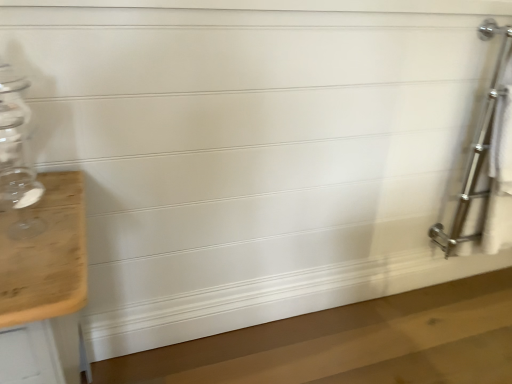
Question: Considering the relative sizes of transparent glass jar at left and polished chrome towel rack at right in the image provided, is transparent glass jar at left thinner than polished chrome towel rack at right?

Choices:
 (A) no
 (B) yes

Answer: (A)

Question: Considering the relative sizes of transparent glass jar at left and polished chrome towel rack at right in the image provided, is transparent glass jar at left shorter than polished chrome towel rack at right?

Choices:
 (A) yes
 (B) no

Answer: (A)

Question: Is transparent glass jar at left taller than polished chrome towel rack at right?

Choices:
 (A) no
 (B) yes

Answer: (A)

Question: Considering the relative positions of transparent glass jar at left and polished chrome towel rack at right in the image provided, is transparent glass jar at left to the right of polished chrome towel rack at right from the viewer's perspective?

Choices:
 (A) no
 (B) yes

Answer: (A)

Question: Is the surface of transparent glass jar at left in direct contact with polished chrome towel rack at right?

Choices:
 (A) no
 (B) yes

Answer: (A)

Question: Does transparent glass jar at left have a smaller size compared to polished chrome towel rack at right?

Choices:
 (A) no
 (B) yes

Answer: (B)

Question: Is polished chrome towel rack at right positioned with its back to transparent glass jar at left?

Choices:
 (A) yes
 (B) no

Answer: (B)

Question: Can you confirm if polished chrome towel rack at right is positioned to the left of transparent glass jar at left?

Choices:
 (A) no
 (B) yes

Answer: (A)

Question: Is polished chrome towel rack at right far away from transparent glass jar at left?

Choices:
 (A) no
 (B) yes

Answer: (B)

Question: From a real-world perspective, is polished chrome towel rack at right positioned over transparent glass jar at left based on gravity?

Choices:
 (A) yes
 (B) no

Answer: (B)

Question: Can you confirm if polished chrome towel rack at right is positioned to the right of transparent glass jar at left?

Choices:
 (A) yes
 (B) no

Answer: (A)

Question: Does polished chrome towel rack at right have a greater width compared to transparent glass jar at left?

Choices:
 (A) yes
 (B) no

Answer: (B)

Question: Considering the positions of polished chrome towel rack at right and transparent glass jar at left in the image, is polished chrome towel rack at right wider or thinner than transparent glass jar at left?

Choices:
 (A) wide
 (B) thin

Answer: (B)